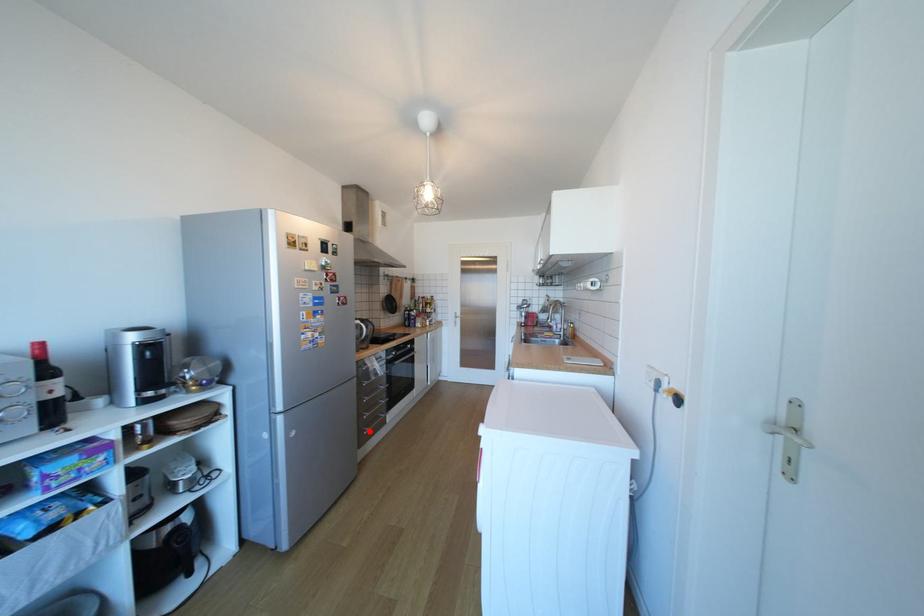
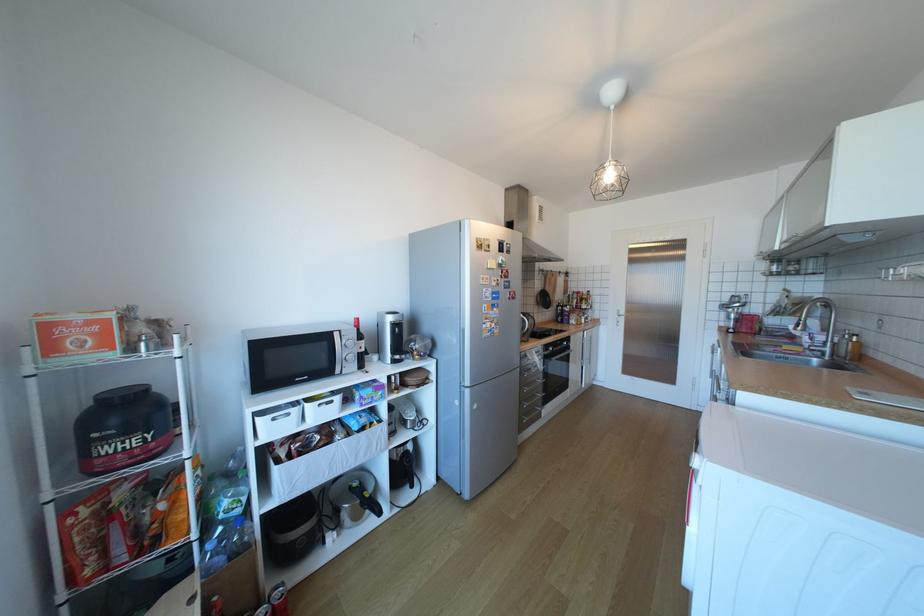
Question: I am providing you with two images of the same scene from different viewpoints. A red point is shown in image1. For the corresponding object point in image2, is it positioned nearer or farther from the camera?

Choices:
 (A) Nearer
 (B) Farther

Answer: (B)